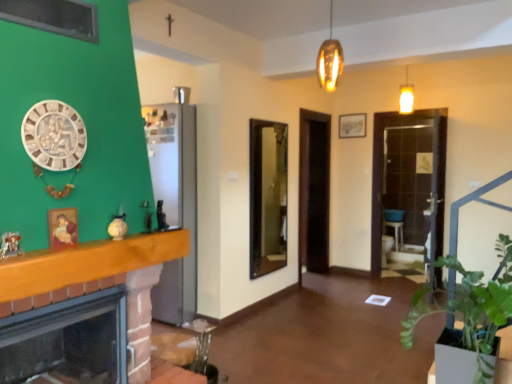
The width and height of the screenshot is (512, 384). What are the coordinates of `free space in front of matte wooden picture frame at left` in the screenshot? It's located at (48, 254).